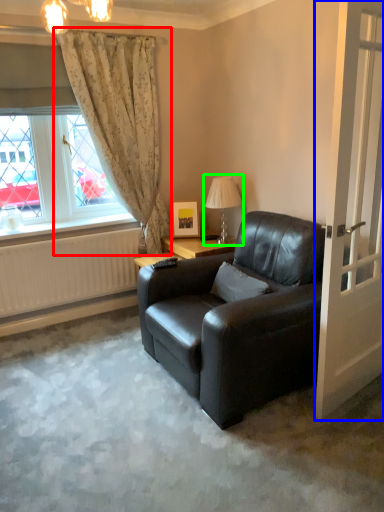
Question: Based on their relative distances, which object is farther from curtain (highlighted by a red box)? Choose from door (highlighted by a blue box) and table lamp (highlighted by a green box).

Choices:
 (A) door
 (B) table lamp

Answer: (A)